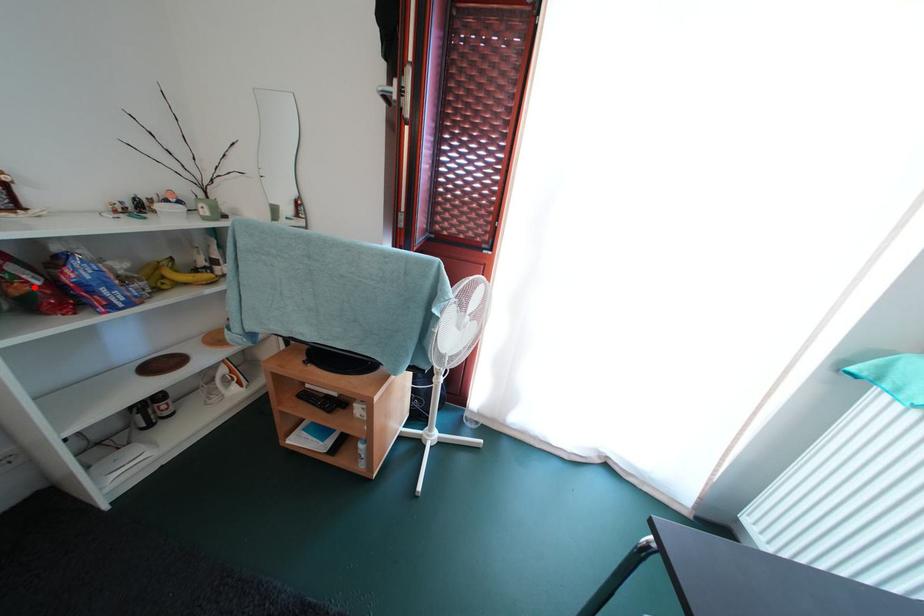
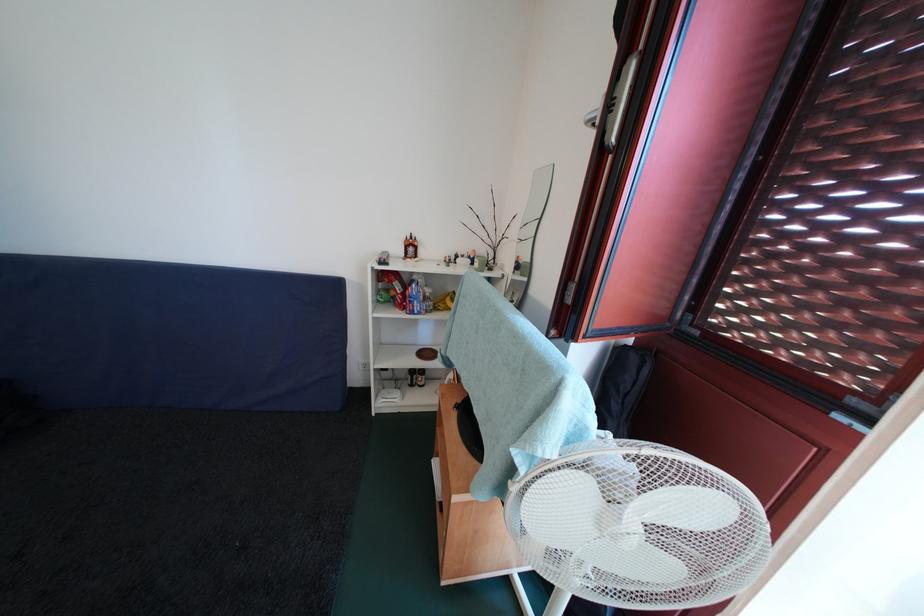
Question: I am providing you with two images of the same scene from different viewpoints. In image1, a red point is highlighted. Considering the same 3D point in image2, which of the following is correct?

Choices:
 (A) It is closer
 (B) It is farther

Answer: (A)